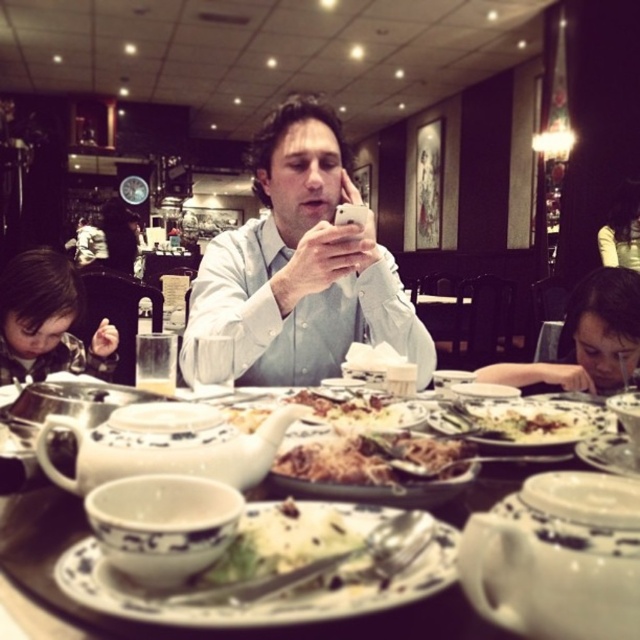
Between white porcelain tableware at center and white creamy sauce at center, which one appears on the right side from the viewer's perspective?

Positioned to the right is white creamy sauce at center.

This screenshot has width=640, height=640. I want to click on white porcelain tableware at center, so click(x=180, y=627).

Does white shirt at center have a greater height compared to smooth brown hair at lower left?

Indeed, white shirt at center has a greater height compared to smooth brown hair at lower left.

Between point (218, 310) and point (51, 321), which one is positioned behind?

Positioned behind is point (51, 321).

Between point (248, 317) and point (54, 269), which one is positioned in front?

Positioned in front is point (248, 317).

This screenshot has height=640, width=640. Identify the location of white shirt at center. (301, 266).

Is white ceramic plate at center further to camera compared to matte black hair at upper right?

No, white ceramic plate at center is in front of matte black hair at upper right.

In the scene shown: Which of these two, white ceramic plate at center or matte black hair at upper right, stands shorter?

With less height is white ceramic plate at center.

Is point (516, 417) positioned before point (634, 200)?

Yes.

This screenshot has width=640, height=640. In order to click on white ceramic plate at center in this screenshot , I will do `click(522, 420)`.